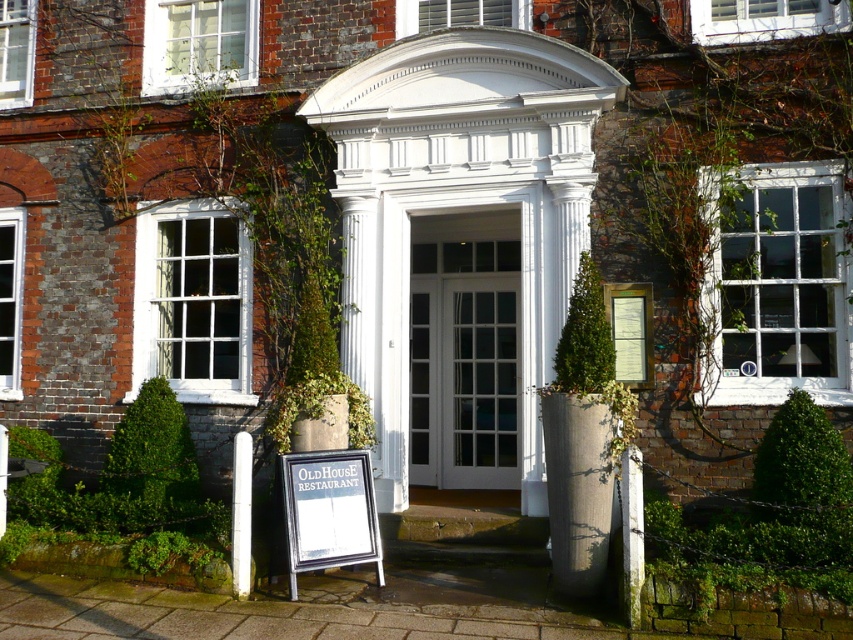
You are a delivery person trying to determine the best side to approach the entrance of Old House Restaurant. You notice two pillars, the white stone pillar at lower right and the white smooth pillar at lower left. Which pillar has a narrower width?

The white stone pillar at lower right has a narrower width than the white smooth pillar at lower left.

You are a delivery person trying to park your 2.5 meters wide delivery van. You see the white stone pillar at lower right and the white smooth pillar at lower left. Can you fit your van between them?

The white stone pillar at lower right is taller than the white smooth pillar at lower left, but the distance between them isn